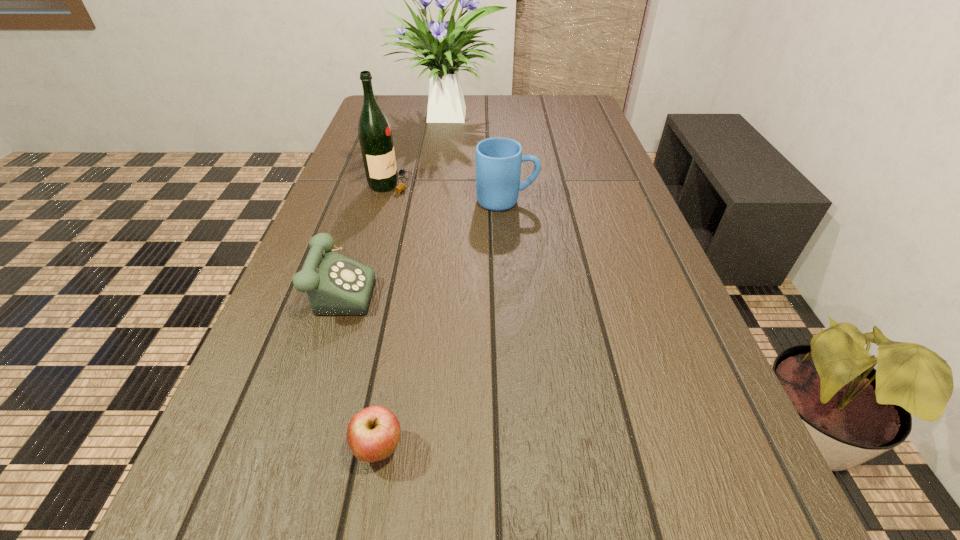
Identify the location of free location located on the side of the mug with the handle. This screenshot has height=540, width=960. (637, 201).

This screenshot has width=960, height=540. I want to click on blank space located on the dial of the second shortest object, so tap(436, 284).

In order to click on free space located on the right of the shortest object in this screenshot , I will do `click(501, 449)`.

Identify the location of object that is at the far edge. (446, 104).

This screenshot has height=540, width=960. Find the location of `flower arrangement positioned at the left edge`. flower arrangement positioned at the left edge is located at coordinates [x=446, y=104].

The width and height of the screenshot is (960, 540). Identify the location of wine bottle present at the left edge. (374, 131).

This screenshot has height=540, width=960. I want to click on telephone positioned at the left edge, so click(335, 285).

I want to click on object positioned at the far left corner, so click(x=446, y=104).

You are a GUI agent. You are given a task and a screenshot of the screen. Output one action in this format:
    pyautogui.click(x=<x>, y=<y>)
    Task: Click on the free space at the far edge of the desktop
    The width and height of the screenshot is (960, 540).
    Given the screenshot: What is the action you would take?
    pyautogui.click(x=483, y=98)

Locate an element on the screen. This screenshot has width=960, height=540. free location at the left edge of the desktop is located at coordinates (343, 339).